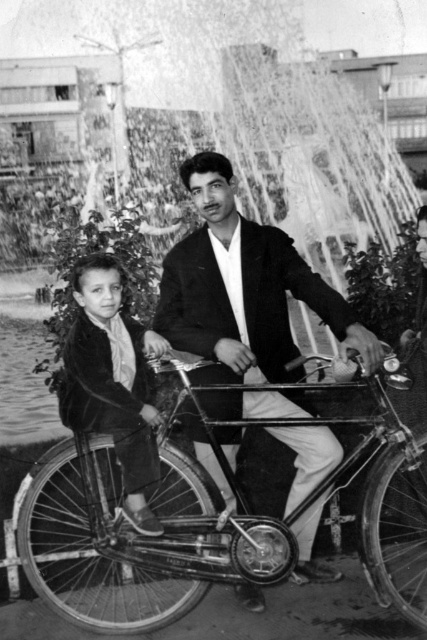
Question: Does smooth black jacket at center have a lesser width compared to velvet jacket at center?

Choices:
 (A) yes
 (B) no

Answer: (B)

Question: Based on their relative distances, which object is nearer to the smooth black jacket at center?

Choices:
 (A) velvet jacket at center
 (B) metallic silver bicycle at center

Answer: (B)

Question: Which of these objects is positioned closest to the smooth black jacket at center?

Choices:
 (A) metallic silver bicycle at center
 (B) velvet jacket at center

Answer: (A)

Question: Can you confirm if smooth black jacket at center is wider than velvet jacket at center?

Choices:
 (A) yes
 (B) no

Answer: (A)

Question: Does metallic silver bicycle at center have a lesser width compared to velvet jacket at center?

Choices:
 (A) yes
 (B) no

Answer: (B)

Question: Estimate the real-world distances between objects in this image. Which object is closer to the velvet jacket at center?

Choices:
 (A) metallic silver bicycle at center
 (B) smooth black jacket at center

Answer: (A)